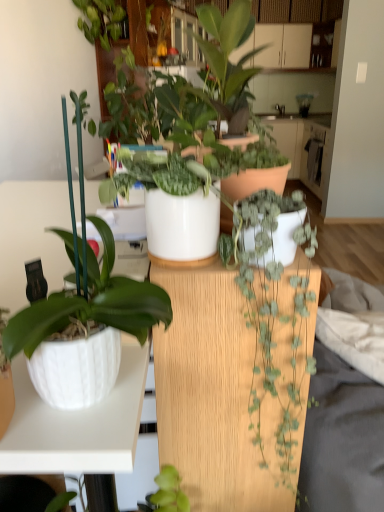
Question: Is white glossy countertop at center closer to camera compared to white glossy pot at left, the third houseplant when ordered from top to bottom?

Choices:
 (A) no
 (B) yes

Answer: (A)

Question: Can you confirm if white glossy countertop at center is thinner than white glossy pot at left, the third houseplant when ordered from top to bottom?

Choices:
 (A) no
 (B) yes

Answer: (A)

Question: From the image's perspective, is white glossy countertop at center below white glossy pot at left, the second houseplant in the bottom-to-top sequence?

Choices:
 (A) yes
 (B) no

Answer: (B)

Question: Are white glossy countertop at center and white glossy pot at left, the third houseplant when ordered from top to bottom, far apart?

Choices:
 (A) yes
 (B) no

Answer: (A)

Question: Is white glossy countertop at center to the left of white glossy pot at left, the second houseplant in the bottom-to-top sequence, from the viewer's perspective?

Choices:
 (A) yes
 (B) no

Answer: (B)

Question: Is white glossy countertop at center next to white glossy pot at left, the second houseplant in the bottom-to-top sequence, and touching it?

Choices:
 (A) no
 (B) yes

Answer: (A)

Question: Can you confirm if white glossy pot at center, placed as the third houseplant when sorted from bottom to top, is positioned to the right of white glossy countertop at center?

Choices:
 (A) yes
 (B) no

Answer: (B)

Question: Could you tell me if white glossy pot at center, placed as the third houseplant when sorted from bottom to top, is turned towards white glossy countertop at center?

Choices:
 (A) no
 (B) yes

Answer: (A)

Question: Considering the relative sizes of white glossy pot at center, placed as the third houseplant when sorted from bottom to top, and white glossy countertop at center in the image provided, is white glossy pot at center, placed as the third houseplant when sorted from bottom to top, shorter than white glossy countertop at center?

Choices:
 (A) no
 (B) yes

Answer: (B)

Question: Is white glossy pot at center, the 2th houseplant when ordered from top to bottom, to the left of white glossy countertop at center from the viewer's perspective?

Choices:
 (A) no
 (B) yes

Answer: (B)

Question: Is white glossy pot at center, the 2th houseplant when ordered from top to bottom, placed right next to white glossy countertop at center?

Choices:
 (A) yes
 (B) no

Answer: (B)

Question: Is white glossy pot at center, the 2th houseplant when ordered from top to bottom, bigger than white glossy countertop at center?

Choices:
 (A) yes
 (B) no

Answer: (B)

Question: Is there a large distance between matte white pot at center, acting as the 1th houseplant starting from the top, and white glossy countertop at center?

Choices:
 (A) no
 (B) yes

Answer: (B)